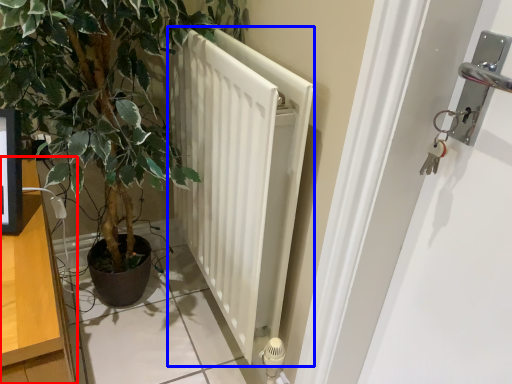
Question: Which object appears farthest to the camera in this image, dresser (highlighted by a red box) or radiator (highlighted by a blue box)?

Choices:
 (A) dresser
 (B) radiator

Answer: (B)